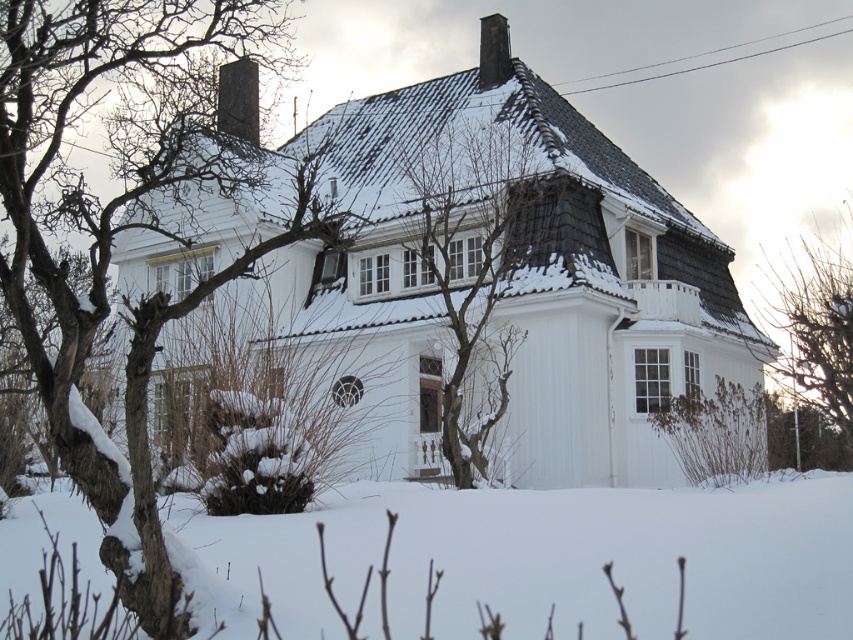
Which of these two, snow-covered branches at left or bare branches at center, stands taller?

snow-covered branches at left is taller.

Can you confirm if snow-covered branches at left is positioned above bare branches at center?

Correct, snow-covered branches at left is located above bare branches at center.

This screenshot has height=640, width=853. Describe the element at coordinates (123, 227) in the screenshot. I see `snow-covered branches at left` at that location.

This screenshot has width=853, height=640. Identify the location of snow-covered branches at left. (123, 227).

Does point (245, 116) lie behind point (491, 22)?

Yes, point (245, 116) is behind point (491, 22).

Between dark gray stone chimney at upper center and smooth gray chimney at upper center, which one appears on the left side from the viewer's perspective?

dark gray stone chimney at upper center is more to the left.

Identify the location of dark gray stone chimney at upper center. (238, 99).

Between white powdery snow at lower center and dark gray stone chimney at upper center, which one appears on the right side from the viewer's perspective?

From the viewer's perspective, white powdery snow at lower center appears more on the right side.

Does white powdery snow at lower center appear over dark gray stone chimney at upper center?

Incorrect, white powdery snow at lower center is not positioned above dark gray stone chimney at upper center.

What do you see at coordinates (553, 557) in the screenshot?
I see `white powdery snow at lower center` at bounding box center [553, 557].

You are a GUI agent. You are given a task and a screenshot of the screen. Output one action in this format:
    pyautogui.click(x=<x>, y=<y>)
    Task: Click on the white powdery snow at lower center
    The width and height of the screenshot is (853, 640).
    Given the screenshot: What is the action you would take?
    pyautogui.click(x=553, y=557)